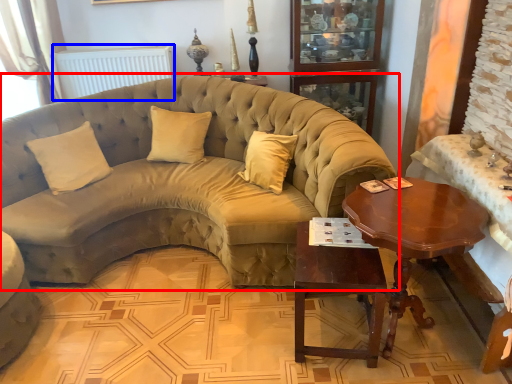
Question: Which of the following is the closest to the observer, studio couch (highlighted by a red box) or radiator (highlighted by a blue box)?

Choices:
 (A) studio couch
 (B) radiator

Answer: (A)